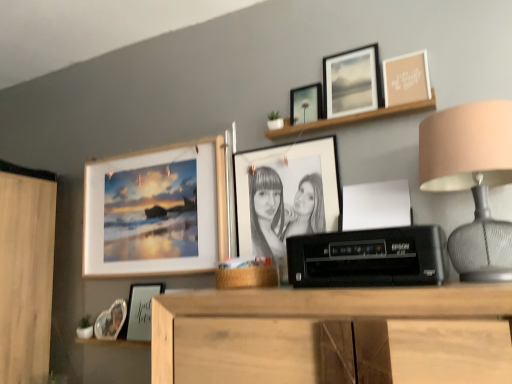
Find the location of a particular element. The image size is (512, 384). vacant space situated above wooden frame at upper center, positioned as the 2th shelf in back-to-front order (from a real-world perspective) is located at coordinates (348, 112).